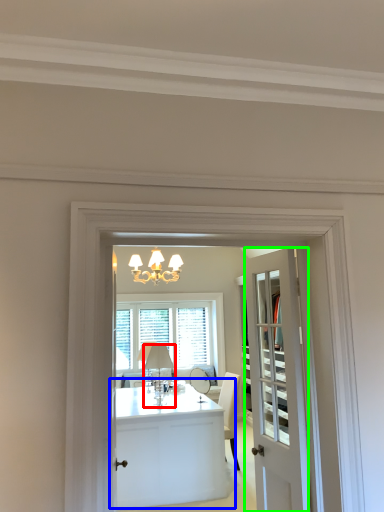
Question: Which object is the closest to the lamp (highlighted by a red box)? Choose among these: table (highlighted by a blue box) or door (highlighted by a green box).

Choices:
 (A) table
 (B) door

Answer: (A)